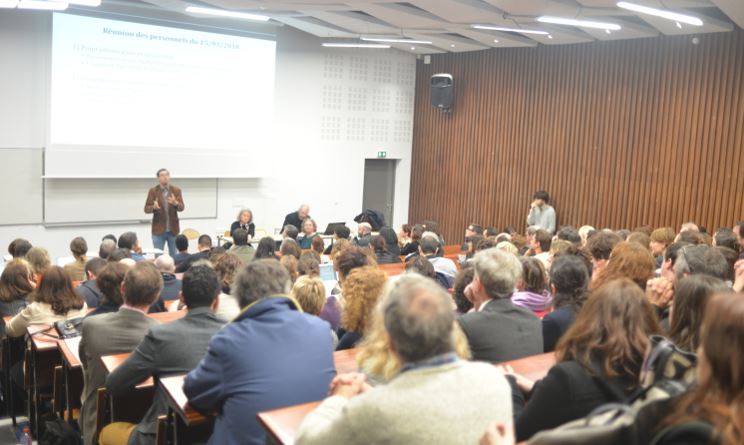
Locate an element on the screen. brown wall on the right is located at coordinates (596, 95).